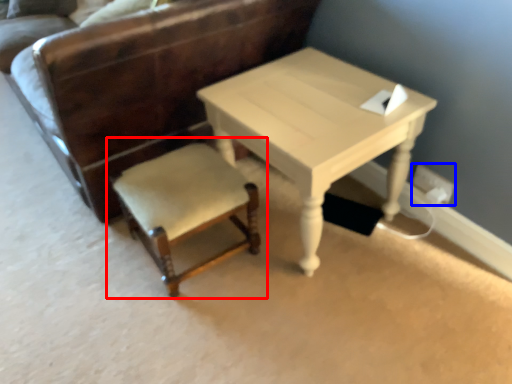
Question: Which of the following is the farthest to the observer, chair (highlighted by a red box) or electric outlet (highlighted by a blue box)?

Choices:
 (A) chair
 (B) electric outlet

Answer: (B)